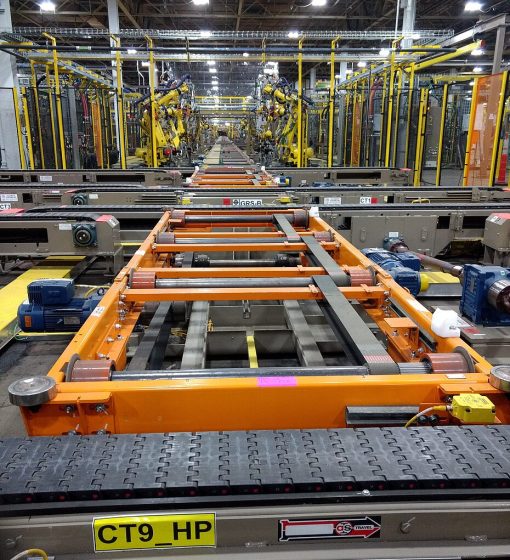
Identify the location of on/off switch. (474, 408).